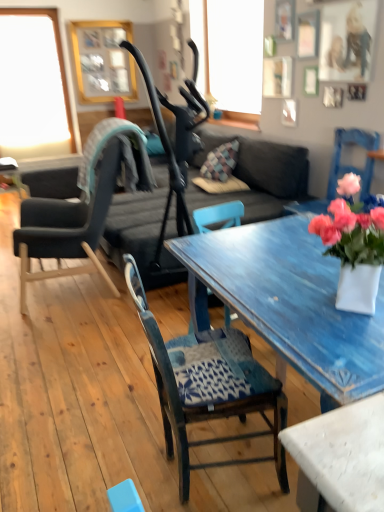
Question: Is wooden chair with patterned cushion at center, which is the 1th chair from front to back, positioned in front of gold wooden picture frame at upper center?

Choices:
 (A) no
 (B) yes

Answer: (B)

Question: From a real-world perspective, is wooden chair with patterned cushion at center, which is the 1th chair from front to back, on top of gold wooden picture frame at upper center?

Choices:
 (A) yes
 (B) no

Answer: (B)

Question: Does wooden chair with patterned cushion at center, the second chair when ordered from back to front, have a greater width compared to gold wooden picture frame at upper center?

Choices:
 (A) yes
 (B) no

Answer: (A)

Question: Is wooden chair with patterned cushion at center, the second chair when ordered from back to front, beside gold wooden picture frame at upper center?

Choices:
 (A) no
 (B) yes

Answer: (A)

Question: Does wooden chair with patterned cushion at center, which is the 1th chair from front to back, turn towards gold wooden picture frame at upper center?

Choices:
 (A) no
 (B) yes

Answer: (A)

Question: In terms of width, does transparent glass window at upper left look wider or thinner when compared to pink matte vase at right?

Choices:
 (A) thin
 (B) wide

Answer: (A)

Question: From a real-world perspective, relative to pink matte vase at right, is transparent glass window at upper left vertically above or below?

Choices:
 (A) above
 (B) below

Answer: (A)

Question: Based on their sizes in the image, would you say transparent glass window at upper left is bigger or smaller than pink matte vase at right?

Choices:
 (A) big
 (B) small

Answer: (A)

Question: In the image, is transparent glass window at upper left positioned in front of or behind pink matte vase at right?

Choices:
 (A) behind
 (B) front

Answer: (A)

Question: From the image's perspective, is dark gray fabric couch at center above or below transparent glass window at upper left?

Choices:
 (A) below
 (B) above

Answer: (A)

Question: Relative to transparent glass window at upper left, is dark gray fabric couch at center in front or behind?

Choices:
 (A) front
 (B) behind

Answer: (A)

Question: Considering the positions of dark gray fabric couch at center and transparent glass window at upper left in the image, is dark gray fabric couch at center wider or thinner than transparent glass window at upper left?

Choices:
 (A) wide
 (B) thin

Answer: (A)

Question: From a real-world perspective, relative to transparent glass window at upper left, is dark gray fabric couch at center vertically above or below?

Choices:
 (A) below
 (B) above

Answer: (A)

Question: Considering the relative positions of wooden chair with patterned cushion at center, positioned as the first chair in right-to-left order, and gold wooden picture frame at upper center in the image provided, is wooden chair with patterned cushion at center, positioned as the first chair in right-to-left order, to the left or to the right of gold wooden picture frame at upper center?

Choices:
 (A) right
 (B) left

Answer: (A)

Question: Is wooden chair with patterned cushion at center, positioned as the first chair in right-to-left order, spatially inside gold wooden picture frame at upper center, or outside of it?

Choices:
 (A) inside
 (B) outside

Answer: (B)